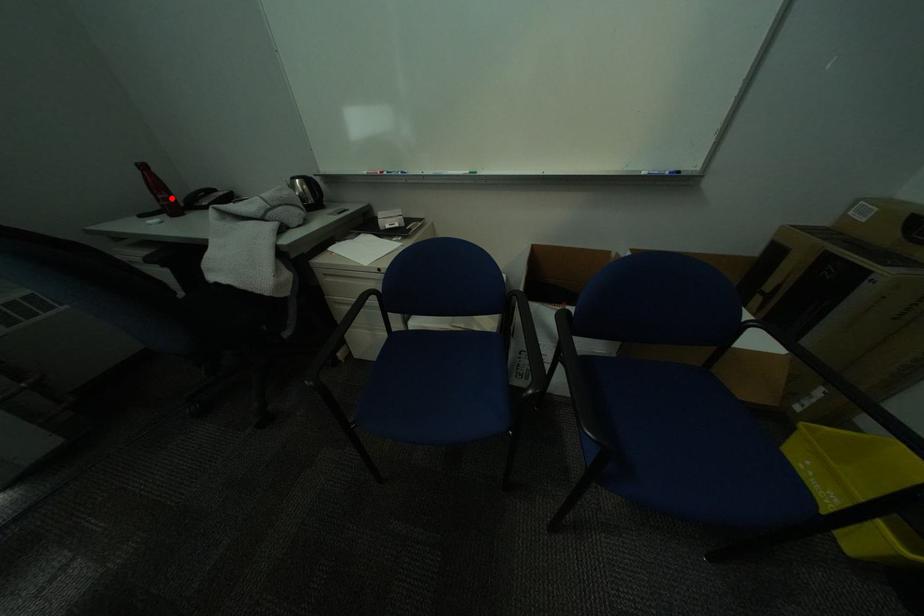
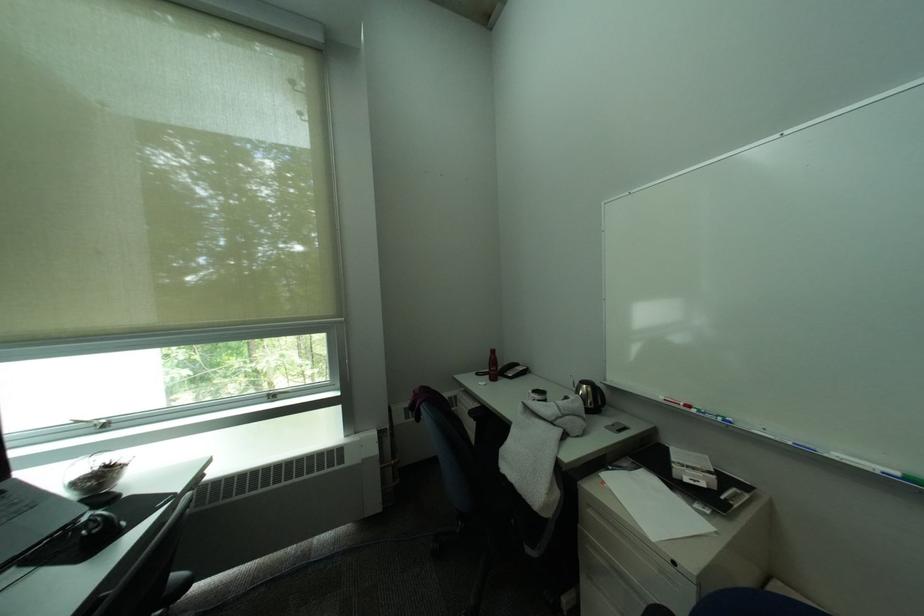
Question: I am providing you with two images of the same scene from different viewpoints. Image1 has a red point marked. In image2, the corresponding 3D location appears at what relative position? Reply with the corresponding letter.

Choices:
 (A) Closer
 (B) Farther

Answer: (B)